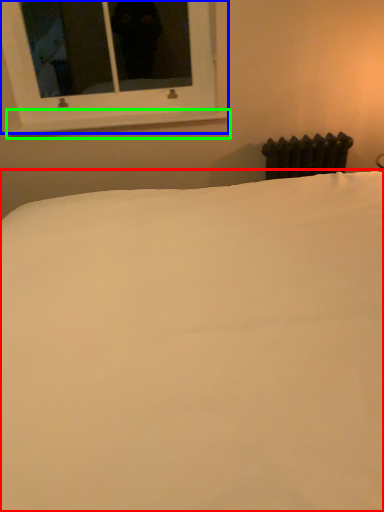
Question: Which object is positioned farthest from bed (highlighted by a red box)? Select from window (highlighted by a blue box) and window sill (highlighted by a green box).

Choices:
 (A) window
 (B) window sill

Answer: (B)